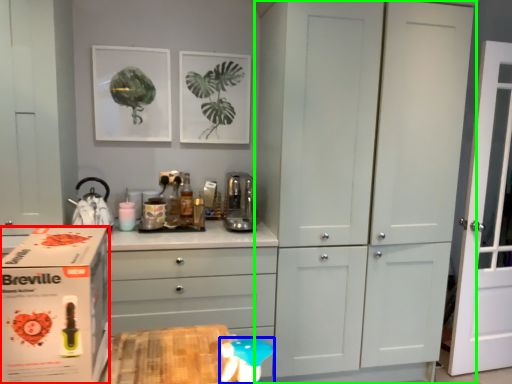
Question: Which object is positioned closest to cardboard box (highlighted by a red box)? Select from toy (highlighted by a blue box) and cupboard (highlighted by a green box).

Choices:
 (A) toy
 (B) cupboard

Answer: (A)